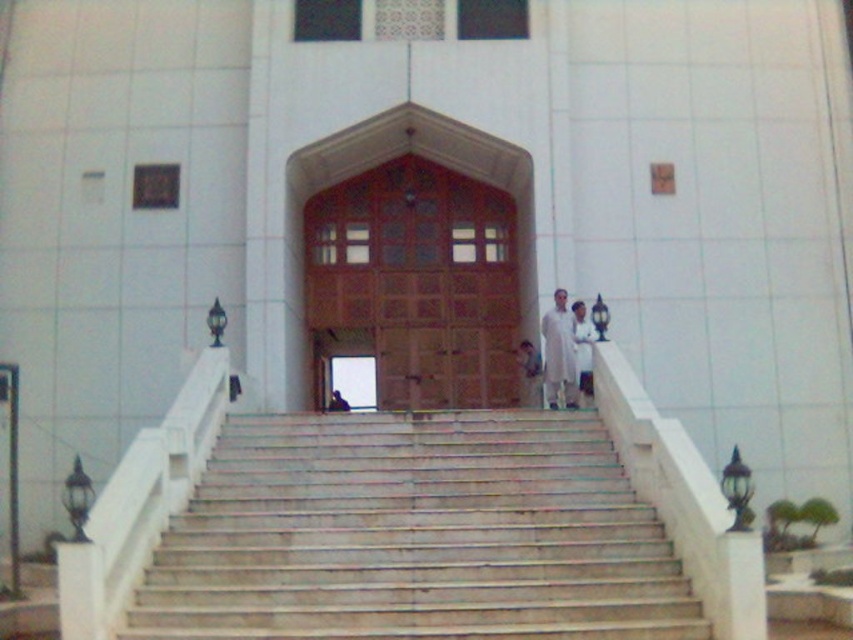
You are standing at the bottom of the stairs in the image. A friend is holding a flashlight and shines it at the point marked by the coordinates point (415, 534). Where will the light hit?

The light will hit the white marble stairs at center because the point (415, 534) corresponds to white marble stairs at center.

You are standing at the bottom of the white marble stairs at center and want to greet the white fabric person at center. In which direction should you walk to reach them?

The white marble stairs at center is to the left of the white fabric person at center, so you should walk to the right to reach them.